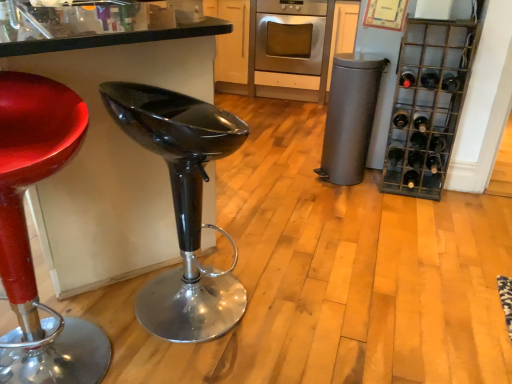
Where is `vacant area that is in front of metallic wine rack at right`? Image resolution: width=512 pixels, height=384 pixels. vacant area that is in front of metallic wine rack at right is located at coordinates (424, 216).